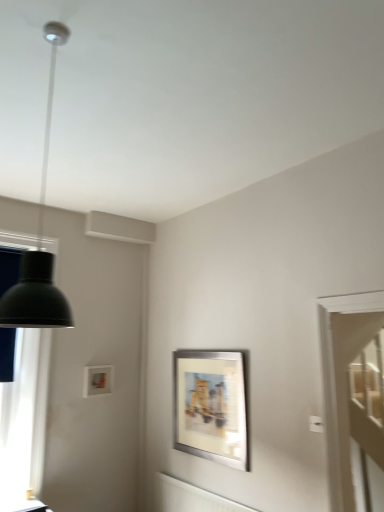
Question: Is silver metallic picture frame at center, the 1th picture frame viewed from the front, in front of or behind matte white picture frame at upper left, which ranks as the first picture frame in left-to-right order, in the image?

Choices:
 (A) behind
 (B) front

Answer: (B)

Question: Is silver metallic picture frame at center, the first picture frame in the right-to-left sequence, inside or outside of matte white picture frame at upper left, marked as the 1th picture frame in a back-to-front arrangement?

Choices:
 (A) outside
 (B) inside

Answer: (A)

Question: Which of these objects is positioned closest to the black matte lamp at left?

Choices:
 (A) matte black table at lower left
 (B) silver metallic picture frame at center, the 1th picture frame viewed from the front
 (C) transparent glass door at right
 (D) matte white picture frame at upper left, which is counted as the second picture frame, starting from the front
 (E) matte black lampshade at left

Answer: (E)

Question: Which of these objects is positioned farthest from the matte white picture frame at upper left, marked as the 1th picture frame in a back-to-front arrangement?

Choices:
 (A) black matte lamp at left
 (B) silver metallic picture frame at center, the first picture frame in the right-to-left sequence
 (C) matte black lampshade at left
 (D) matte black table at lower left
 (E) transparent glass door at right

Answer: (E)